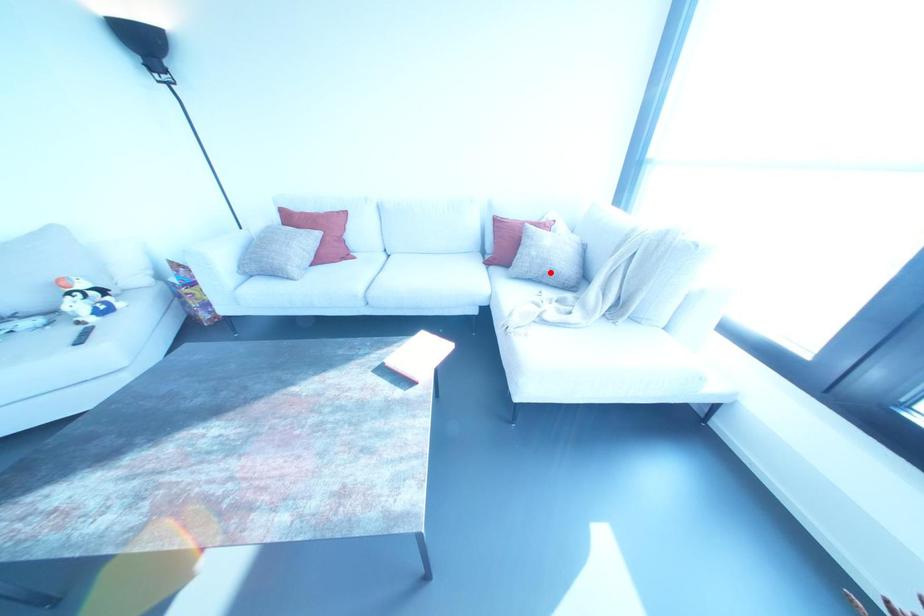
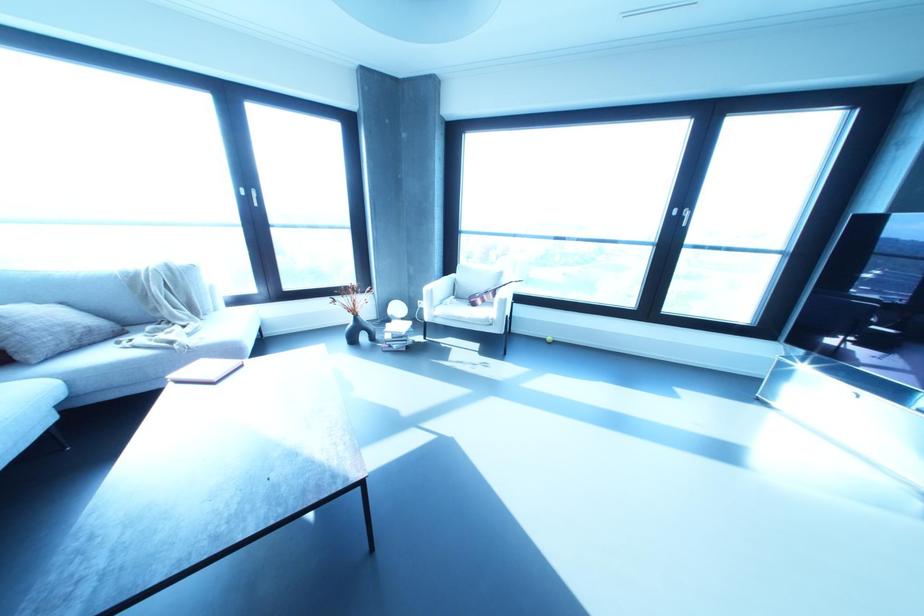
Question: A red point is marked in image1. In image2, is the corresponding 3D point closer to the camera or farther? Reply with the corresponding letter.

Choices:
 (A) The corresponding 3D point is closer.
 (B) The corresponding 3D point is farther.

Answer: (B)